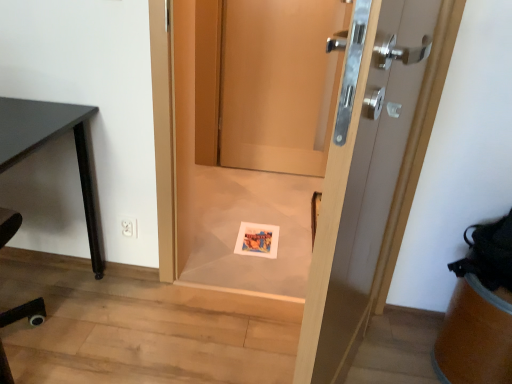
Question: Considering the relative positions of wooden door at center, the third door positioned from the front, and matte wood door at center, the 1th door when ordered from front to back, in the image provided, is wooden door at center, the third door positioned from the front, to the left or to the right of matte wood door at center, the 1th door when ordered from front to back,?

Choices:
 (A) left
 (B) right

Answer: (A)

Question: Is wooden door at center, the first door in the back-to-front sequence, wider or thinner than matte wood door at center, the 1th door when ordered from front to back?

Choices:
 (A) thin
 (B) wide

Answer: (A)

Question: Considering the real-world distances, which object is closest to the white plastic electric outlet at lower left?

Choices:
 (A) matte paper postcard at center
 (B) matte wood door at center, positioned as the 2th door in back-to-front order
 (C) matte black desk at left
 (D) wooden door at center, the first door in the back-to-front sequence
 (E) matte wood door at center, acting as the third door starting from the back

Answer: (C)

Question: Considering the real-world distances, which object is farthest from the wooden door at center, the third door positioned from the front?

Choices:
 (A) matte black desk at left
 (B) matte wood door at center, acting as the third door starting from the back
 (C) matte wood door at center, marked as the 2th door in a front-to-back arrangement
 (D) white plastic electric outlet at lower left
 (E) matte paper postcard at center

Answer: (B)